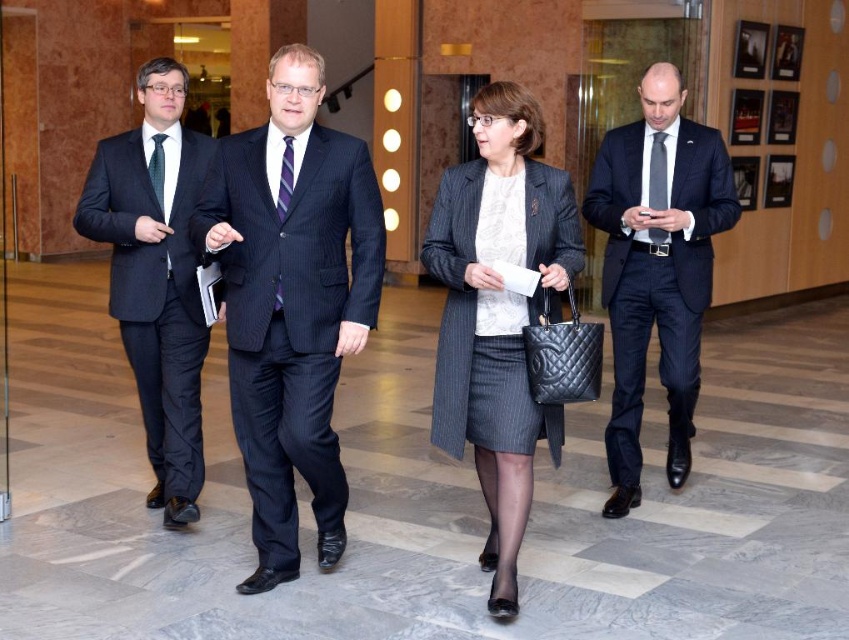
Is matte gray tie at center behind black silk tie at left?

Yes, it is.

Find the location of a particular element. matte gray tie at center is located at coordinates (656, 173).

What do you see at coordinates (656, 173) in the screenshot?
I see `matte gray tie at center` at bounding box center [656, 173].

Identify the location of matte gray tie at center. (656, 173).

Can you confirm if matte gray coat at center is positioned to the left of black silk tie at left?

In fact, matte gray coat at center is to the right of black silk tie at left.

Which is behind, point (495, 419) or point (150, 161)?

Positioned behind is point (150, 161).

This screenshot has width=849, height=640. What do you see at coordinates (498, 312) in the screenshot? I see `matte gray coat at center` at bounding box center [498, 312].

Locate an element on the screen. matte gray coat at center is located at coordinates (498, 312).

Is matte black suit at left taller than matte gray tie at center?

Yes.

Is matte black suit at left in front of matte gray tie at center?

Yes, matte black suit at left is in front of matte gray tie at center.

Does point (195, 513) come in front of point (656, 195)?

Yes, it is in front of point (656, 195).

What are the coordinates of `matte black suit at left` in the screenshot? It's located at (156, 278).